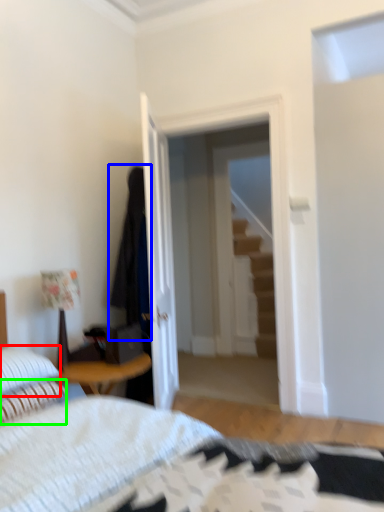
Question: Which object is the closest to the pillow (highlighted by a red box)? Choose among these: robe (highlighted by a blue box) or pillow (highlighted by a green box).

Choices:
 (A) robe
 (B) pillow

Answer: (B)